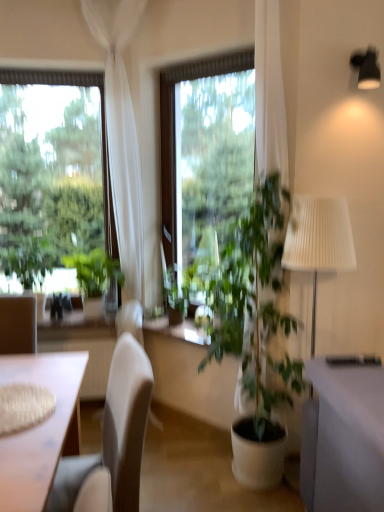
Question: Is white sheer curtain at left smaller than transparent glass window at center, the 2th window from the left?

Choices:
 (A) yes
 (B) no

Answer: (B)

Question: Is white sheer curtain at left oriented away from transparent glass window at center, the 2th window from the left?

Choices:
 (A) yes
 (B) no

Answer: (B)

Question: From the image's perspective, is white sheer curtain at left on transparent glass window at center, the 2th window from the left?

Choices:
 (A) no
 (B) yes

Answer: (A)

Question: Can you confirm if white sheer curtain at left is bigger than transparent glass window at center, the 2th window from the left?

Choices:
 (A) no
 (B) yes

Answer: (B)

Question: Does white sheer curtain at left lie behind transparent glass window at center, the 2th window from the left?

Choices:
 (A) no
 (B) yes

Answer: (A)

Question: Are white sheer curtain at left and transparent glass window at center, the 1th window in the right-to-left sequence, far apart?

Choices:
 (A) no
 (B) yes

Answer: (A)

Question: Is green leafy plant at left, marked as the first houseplant in a left-to-right arrangement, shorter than white sheer curtain at left?

Choices:
 (A) no
 (B) yes

Answer: (B)

Question: Is green leafy plant at left, marked as the first houseplant in a left-to-right arrangement, wider than white sheer curtain at left?

Choices:
 (A) yes
 (B) no

Answer: (B)

Question: From the image's perspective, does green leafy plant at left, marked as the first houseplant in a left-to-right arrangement, appear lower than white sheer curtain at left?

Choices:
 (A) yes
 (B) no

Answer: (A)

Question: From a real-world perspective, is green leafy plant at left, marked as the first houseplant in a left-to-right arrangement, below white sheer curtain at left?

Choices:
 (A) no
 (B) yes

Answer: (B)

Question: Does green leafy plant at left, marked as the first houseplant in a left-to-right arrangement, appear on the right side of white sheer curtain at left?

Choices:
 (A) yes
 (B) no

Answer: (B)

Question: Is green leafy plant at left, placed as the second houseplant when sorted from right to left, outside white sheer curtain at left?

Choices:
 (A) yes
 (B) no

Answer: (B)

Question: Is transparent glass window at center, the 2th window from the left, far from green leafy plant at left?

Choices:
 (A) no
 (B) yes

Answer: (B)